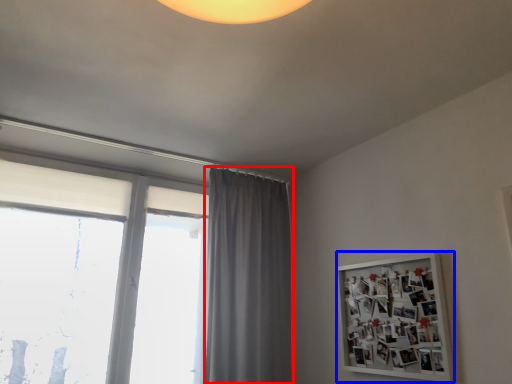
Question: Among these objects, which one is nearest to the camera, curtain (highlighted by a red box) or bulletin board (highlighted by a blue box)?

Choices:
 (A) curtain
 (B) bulletin board

Answer: (B)